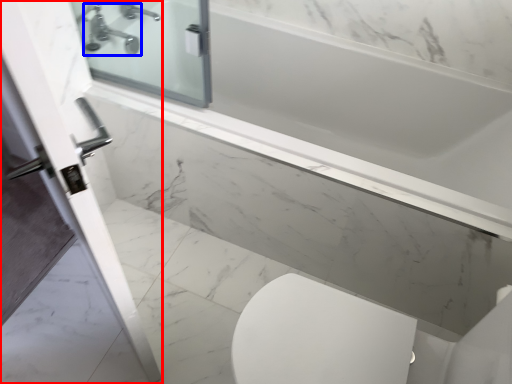
Question: Which point is further to the camera, screen door (highlighted by a red box) or tap (highlighted by a blue box)?

Choices:
 (A) screen door
 (B) tap

Answer: (B)